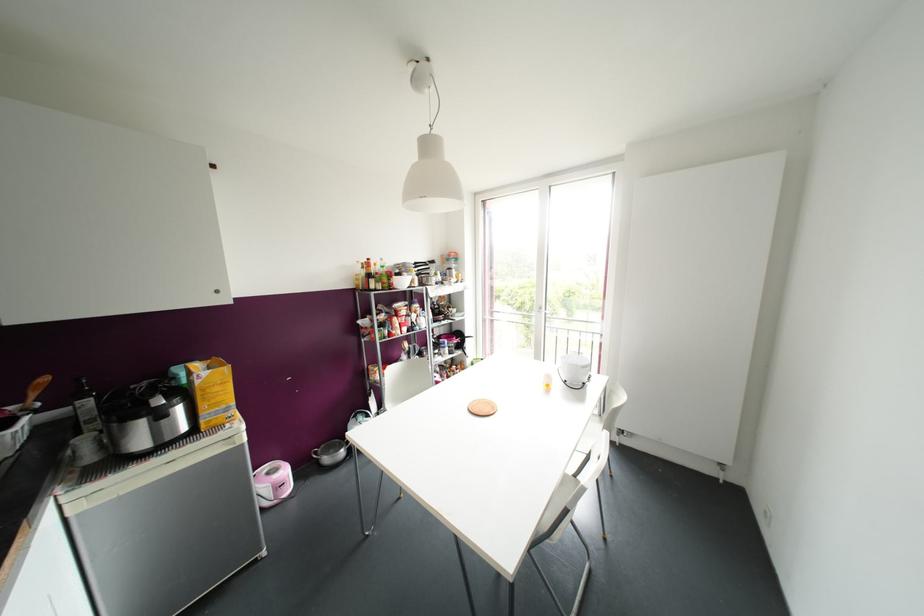
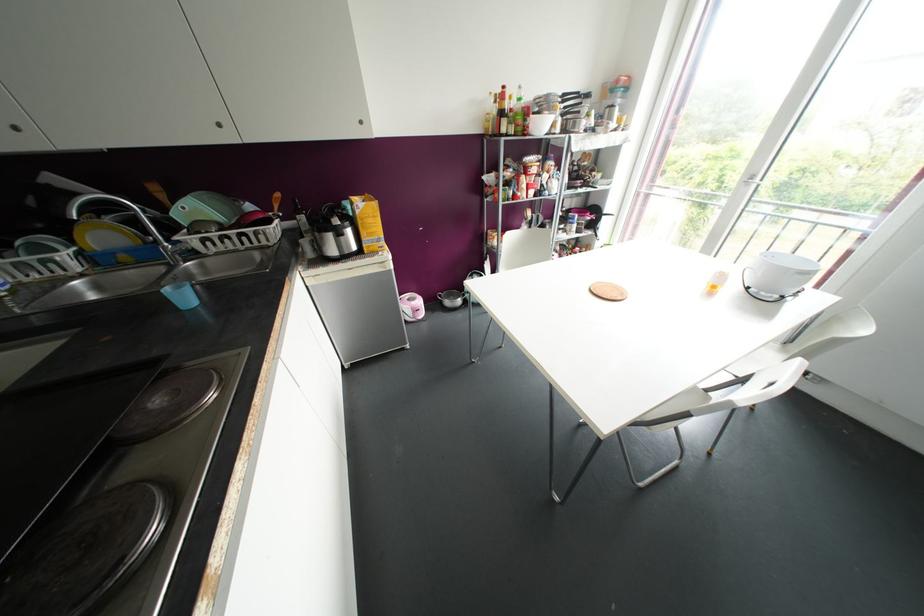
In the second image, find the point that corresponds to pixel 216 291 in the first image.

(360, 122)